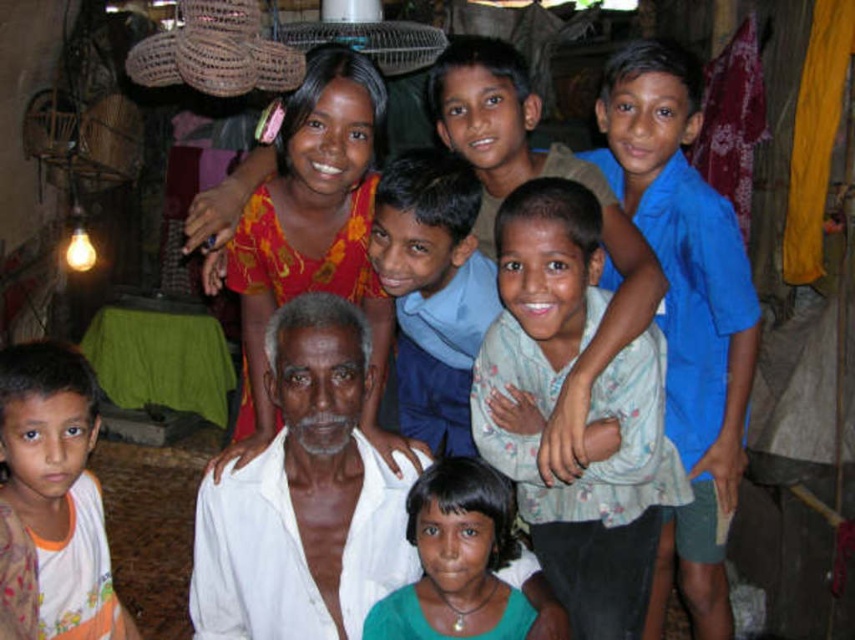
Question: Does floral cotton shirt at center come behind blue cotton shirt at center?

Choices:
 (A) yes
 (B) no

Answer: (B)

Question: Which point is closer to the camera?

Choices:
 (A) (351, 596)
 (B) (482, 65)

Answer: (A)

Question: Which point is farther to the camera?

Choices:
 (A) (366, 188)
 (B) (7, 454)
 (C) (326, 358)

Answer: (A)

Question: Does white cotton shirt at center appear over blue cotton shirt at center?

Choices:
 (A) yes
 (B) no

Answer: (B)

Question: Does white cotton shirt at center appear under white cloth at center?

Choices:
 (A) no
 (B) yes

Answer: (A)

Question: Which point appears farthest from the camera in this image?

Choices:
 (A) (379, 132)
 (B) (443, 164)
 (C) (608, 579)
 (D) (346, 339)

Answer: (A)